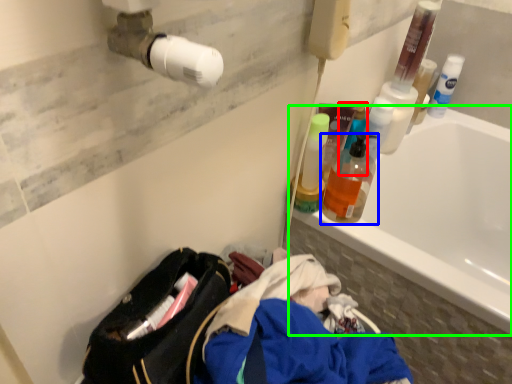
Question: Considering the real-world distances, which object is closest to cleaning product (highlighted by a red box)? bottle (highlighted by a blue box) or bathtub (highlighted by a green box).

Choices:
 (A) bottle
 (B) bathtub

Answer: (A)